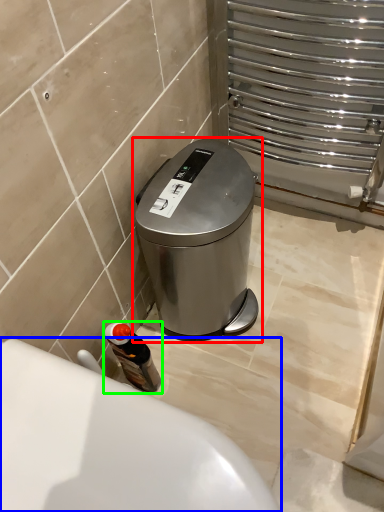
Question: Which object is positioned farthest from waste container (highlighted by a red box)? Select from bath (highlighted by a blue box) and bottle (highlighted by a green box).

Choices:
 (A) bath
 (B) bottle

Answer: (A)